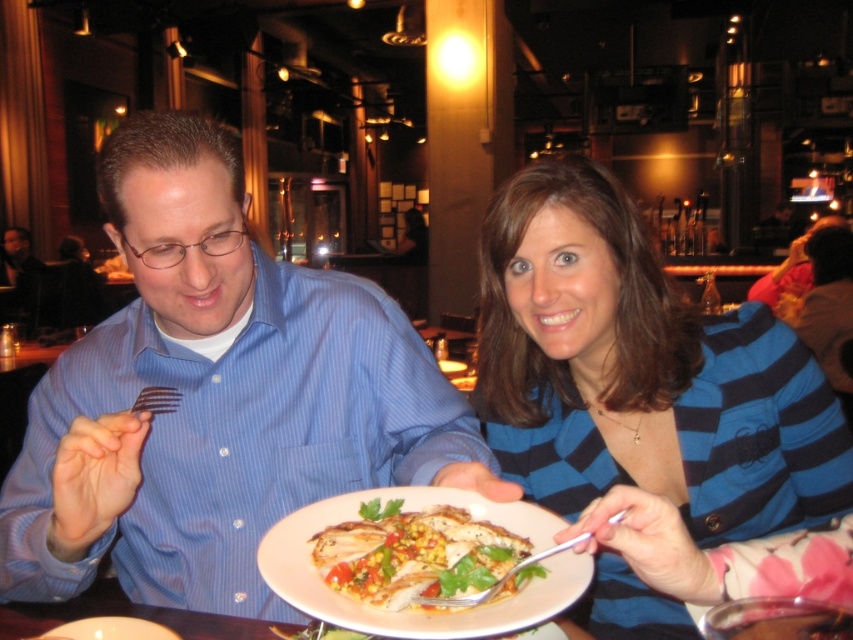
You are a photographer taking a picture of two people sitting at a table. You notice the blue striped shirt at center and the blue striped sweater at center. Which one is more to the left?

The blue striped shirt at center is more to the left because it is positioned on the left side of the blue striped sweater at center.

You are a photographer trying to capture a group photo of the two people at the table. Since you want to ensure both individuals are clearly visible, you need to adjust the camera angle so that their clothing details are not overlapping. Given the blue striped shirt at center and the blue striped sweater at center, which clothing item should be placed closer to the camera to prevent overlap?

The blue striped shirt at center should be placed closer to the camera because its width is larger than the blue striped sweater at center, reducing the chance of overlap.